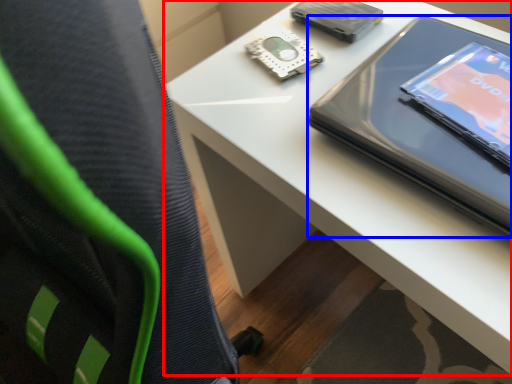
Question: Which object appears closest to the camera in this image, table (highlighted by a red box) or tablet computer (highlighted by a blue box)?

Choices:
 (A) table
 (B) tablet computer

Answer: (A)